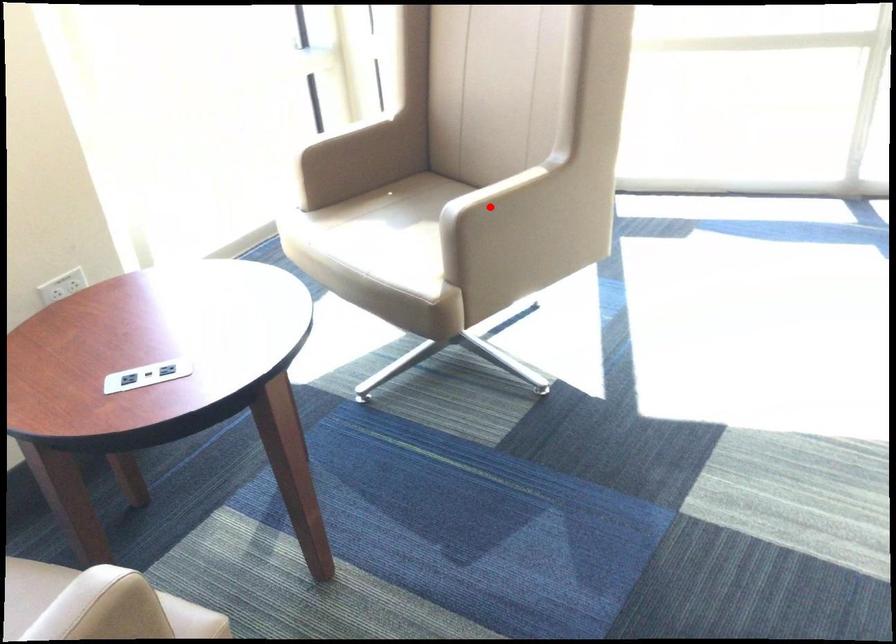
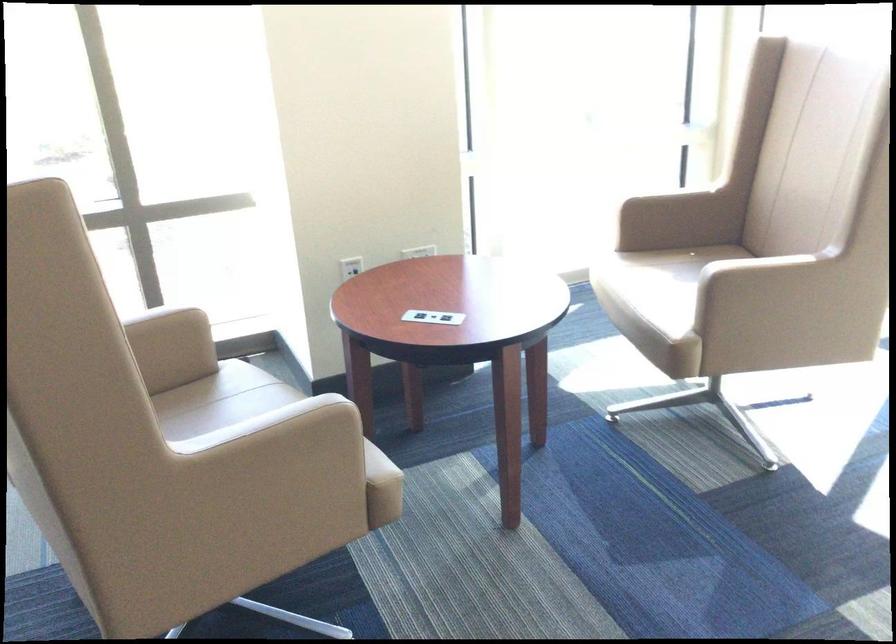
Where in the second image is the point corresponding to the highlighted location from the first image?

(744, 270)